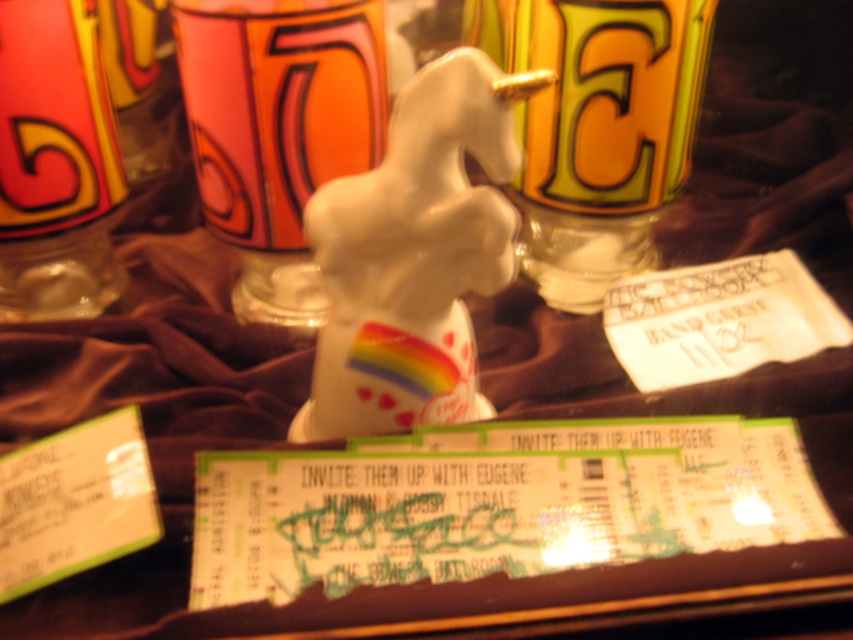
Question: Which is nearer to the matte ceramic mug at upper center?

Choices:
 (A) white glossy unicorn at center
 (B) matte ceramic mug at center
 (C) translucent glass bottle at left

Answer: (B)

Question: Is matte ceramic mug at center wider than translucent glass bottle at left?

Choices:
 (A) no
 (B) yes

Answer: (B)

Question: Which point is closer to the camera?

Choices:
 (A) translucent glass bottle at left
 (B) white glossy unicorn at center

Answer: (B)

Question: In this image, where is matte ceramic mug at center located relative to translucent glass bottle at left?

Choices:
 (A) above
 (B) below

Answer: (A)

Question: Which point is closer to the camera?

Choices:
 (A) matte ceramic mug at center
 (B) white glossy unicorn at center

Answer: (B)

Question: Does white glossy unicorn at center appear on the left side of translucent glass bottle at left?

Choices:
 (A) no
 (B) yes

Answer: (A)